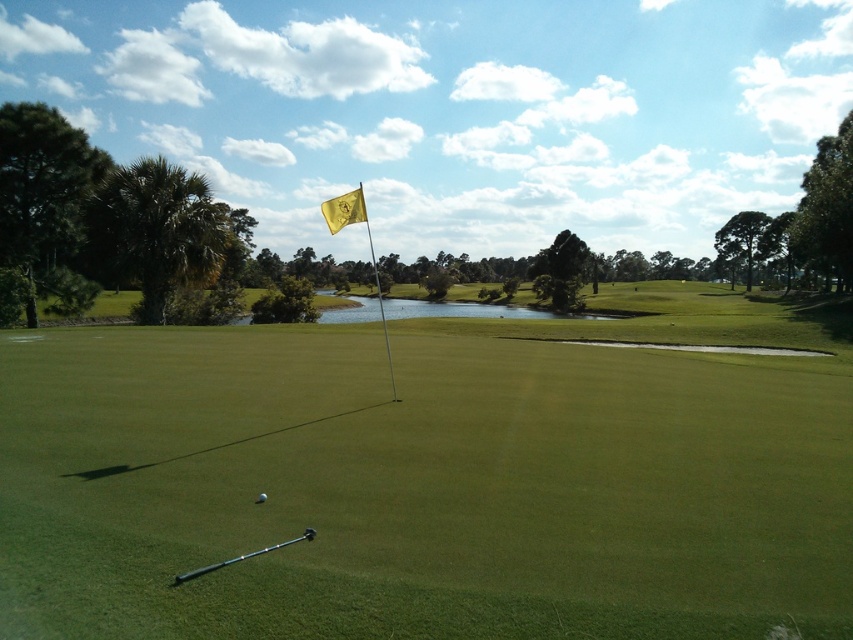
You are a golfer trying to hit the gold fabric flag at center from where you are standing on the green smooth grass at center. The flag is 30.63 feet away. If your maximum driving distance is 28 feet, can you reach the flag in one putt?

The green smooth grass at center is 30.63 feet from the gold fabric flag at center. Since your maximum driving distance is 28 feet, you cannot reach the flag in one putt.